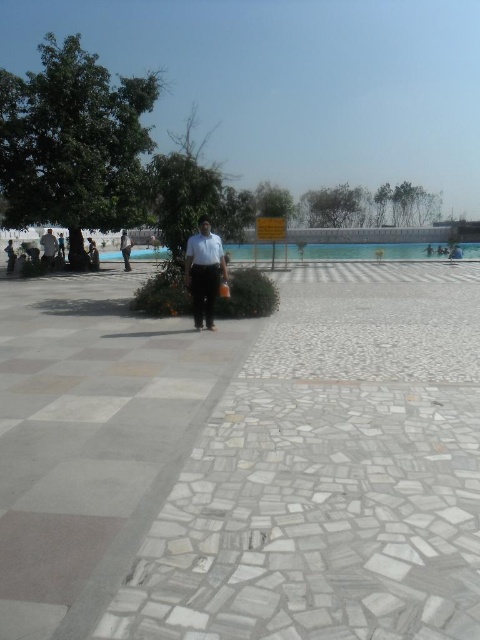
Question: Which point is farther from the camera taking this photo?

Choices:
 (A) tap(136, 545)
 (B) tap(337, 259)

Answer: (B)

Question: Considering the relative positions of white matte shirt at center and light blue fabric shirt at center in the image provided, where is white matte shirt at center located with respect to light blue fabric shirt at center?

Choices:
 (A) above
 (B) below

Answer: (B)

Question: Does green leafy tree at upper center appear under light blue fabric shirt at center?

Choices:
 (A) no
 (B) yes

Answer: (A)

Question: Among these points, which one is nearest to the camera?

Choices:
 (A) (151, 144)
 (B) (365, 202)

Answer: (A)

Question: Can you confirm if clear glass pool at center is positioned to the right of white matte shirt at center?

Choices:
 (A) yes
 (B) no

Answer: (A)

Question: Which of these objects is positioned closest to the white mosaic pavement at center?

Choices:
 (A) green leafy tree at upper center
 (B) white matte shirt at center
 (C) light brown leather jacket at left
 (D) light blue fabric shirt at center

Answer: (B)